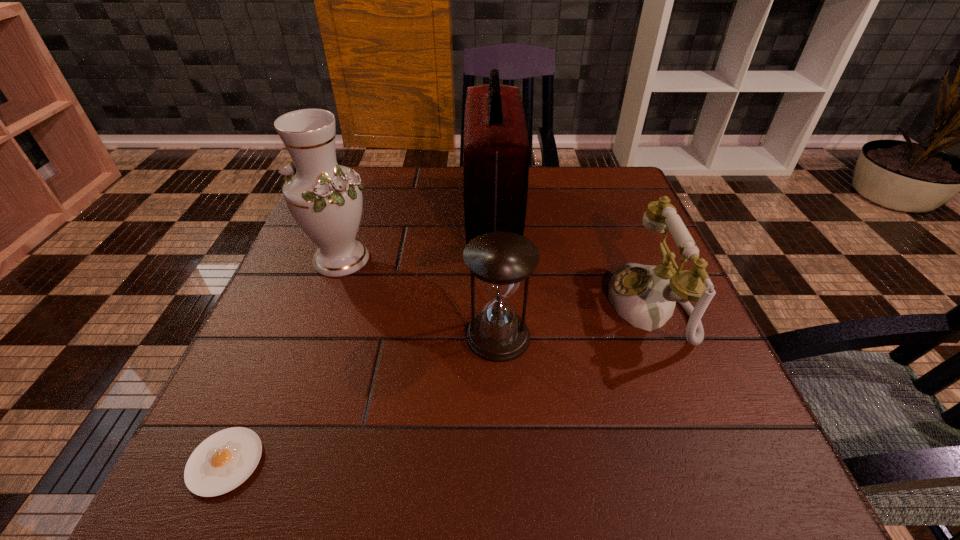
Where is `vacant area situated on the front of the hourglass`? The width and height of the screenshot is (960, 540). vacant area situated on the front of the hourglass is located at coordinates (502, 431).

At what (x,y) coordinates should I click in order to perform the action: click on blank area located 0.160m on the dial of the telephone. Please return your answer as a coordinate pair (x, y). The width and height of the screenshot is (960, 540). Looking at the image, I should click on (529, 305).

I want to click on free space located on the dial of the telephone, so click(458, 305).

The image size is (960, 540). Identify the location of free space located 0.320m on the dial of the telephone. (448, 305).

Where is `vacant space located 0.300m on the back of the nearest object`? This screenshot has width=960, height=540. vacant space located 0.300m on the back of the nearest object is located at coordinates (300, 293).

Image resolution: width=960 pixels, height=540 pixels. I want to click on object that is at the far edge, so click(496, 149).

Where is `object at the near edge`? This screenshot has width=960, height=540. object at the near edge is located at coordinates (223, 461).

Where is `vase that is at the left edge`? vase that is at the left edge is located at coordinates (325, 199).

Where is `egg yolk positioned at the left edge`? This screenshot has height=540, width=960. egg yolk positioned at the left edge is located at coordinates (223, 461).

You are a GUI agent. You are given a task and a screenshot of the screen. Output one action in this format:
    pyautogui.click(x=<x>, y=<y>)
    Task: Click on the object present at the right edge
    This screenshot has width=960, height=540.
    Given the screenshot: What is the action you would take?
    pyautogui.click(x=645, y=296)